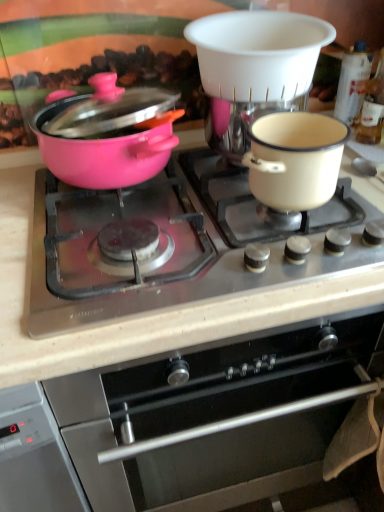
Question: Does stainless steel oven at center come in front of white plastic coffee machine at upper center?

Choices:
 (A) yes
 (B) no

Answer: (A)

Question: Is stainless steel oven at center not within white plastic coffee machine at upper center?

Choices:
 (A) no
 (B) yes

Answer: (B)

Question: Is stainless steel oven at center to the right of white plastic coffee machine at upper center from the viewer's perspective?

Choices:
 (A) yes
 (B) no

Answer: (B)

Question: Can you confirm if stainless steel oven at center is thinner than white plastic coffee machine at upper center?

Choices:
 (A) yes
 (B) no

Answer: (B)

Question: From the image's perspective, does stainless steel oven at center appear higher than white plastic coffee machine at upper center?

Choices:
 (A) no
 (B) yes

Answer: (A)

Question: Does stainless steel oven at center have a lesser height compared to white plastic coffee machine at upper center?

Choices:
 (A) no
 (B) yes

Answer: (A)

Question: Is white plastic coffee machine at upper center turned away from stainless steel oven at center?

Choices:
 (A) yes
 (B) no

Answer: (B)

Question: From the image's perspective, is white plastic coffee machine at upper center over stainless steel oven at center?

Choices:
 (A) yes
 (B) no

Answer: (A)

Question: Is white plastic coffee machine at upper center not within stainless steel oven at center?

Choices:
 (A) no
 (B) yes

Answer: (B)

Question: Does white plastic coffee machine at upper center touch stainless steel oven at center?

Choices:
 (A) yes
 (B) no

Answer: (B)

Question: Is white plastic coffee machine at upper center to the left of stainless steel oven at center from the viewer's perspective?

Choices:
 (A) yes
 (B) no

Answer: (B)

Question: Considering the relative sizes of white plastic coffee machine at upper center and stainless steel oven at center in the image provided, is white plastic coffee machine at upper center shorter than stainless steel oven at center?

Choices:
 (A) no
 (B) yes

Answer: (B)

Question: Is cream enamel pot at right directly adjacent to stainless steel oven at center?

Choices:
 (A) no
 (B) yes

Answer: (A)